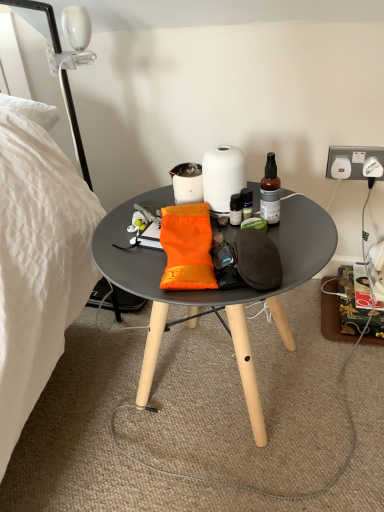
The height and width of the screenshot is (512, 384). What are the coordinates of `free location to the left of orange fabric pouch at center` in the screenshot? It's located at (127, 265).